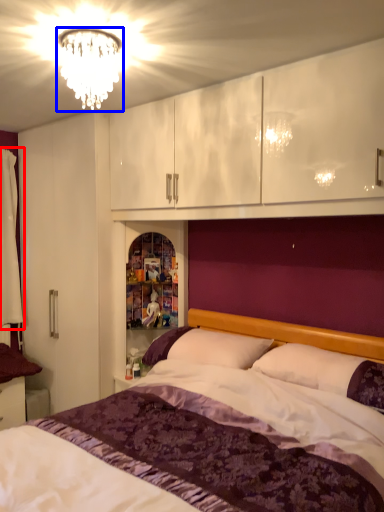
Question: Among these objects, which one is farthest to the camera, curtain (highlighted by a red box) or fixture (highlighted by a blue box)?

Choices:
 (A) curtain
 (B) fixture

Answer: (A)